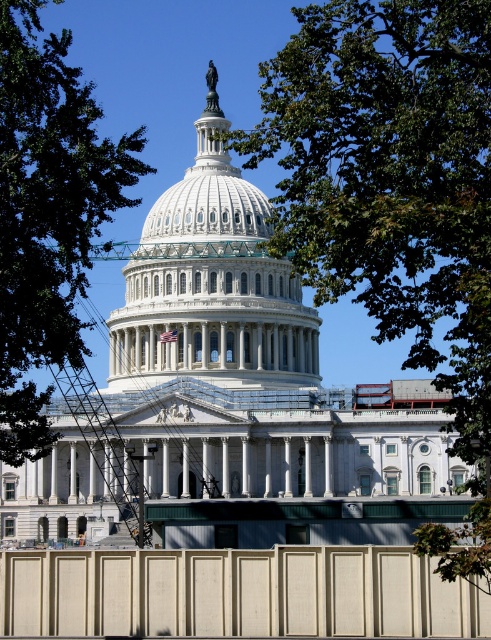
You are standing in front of the United States Capitol building and notice two green leafy trees in the image. Which tree, the green leafy tree at upper center or the green leafy tree at upper left, is positioned more to the right side of the scene?

The green leafy tree at upper center is positioned more to the right side of the scene compared to the green leafy tree at upper left.